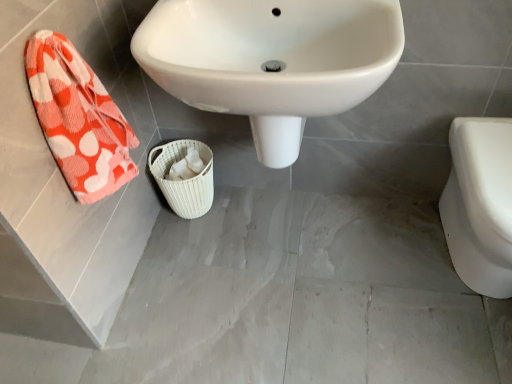
Where is `vacant area that is in front of white woven basket at center`? The image size is (512, 384). vacant area that is in front of white woven basket at center is located at coordinates (193, 246).